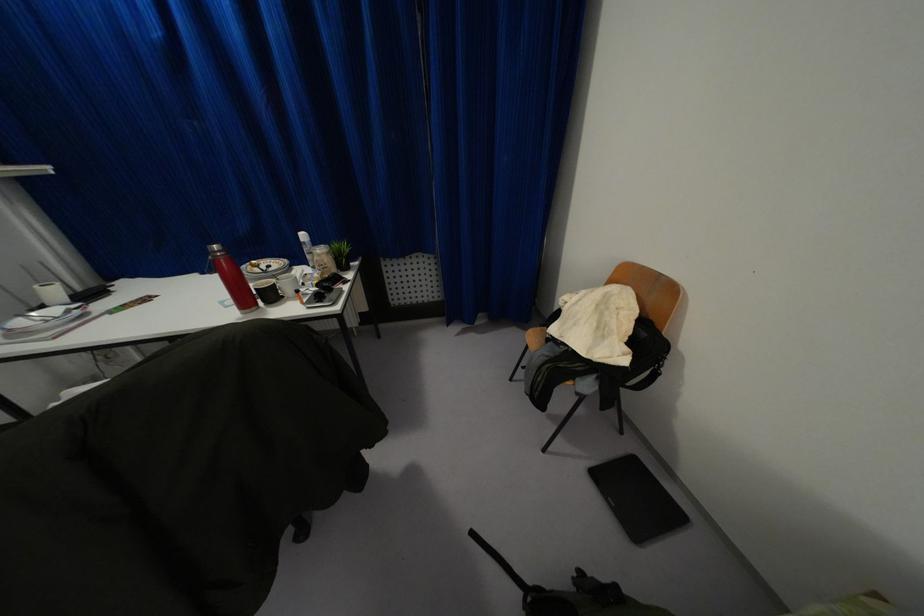
Which object does [266,291] point to?

It corresponds to the black coffee mug in the image.